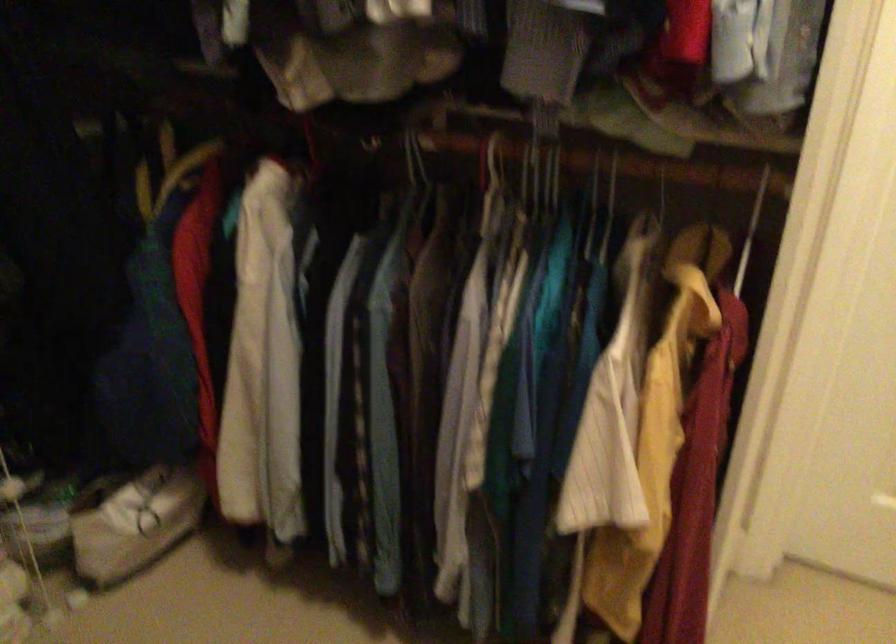
What do you see at coordinates (149, 506) in the screenshot?
I see `a white bag handle` at bounding box center [149, 506].